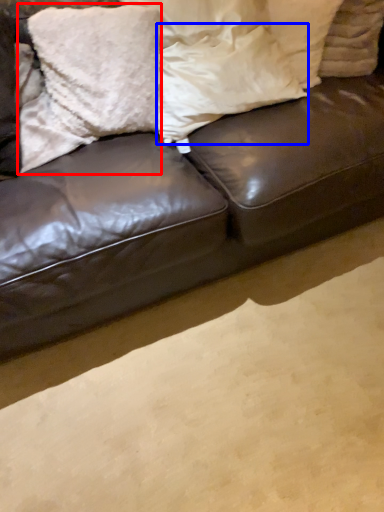
Question: Which object is further to the camera taking this photo, pillow (highlighted by a red box) or pillow (highlighted by a blue box)?

Choices:
 (A) pillow
 (B) pillow

Answer: (A)